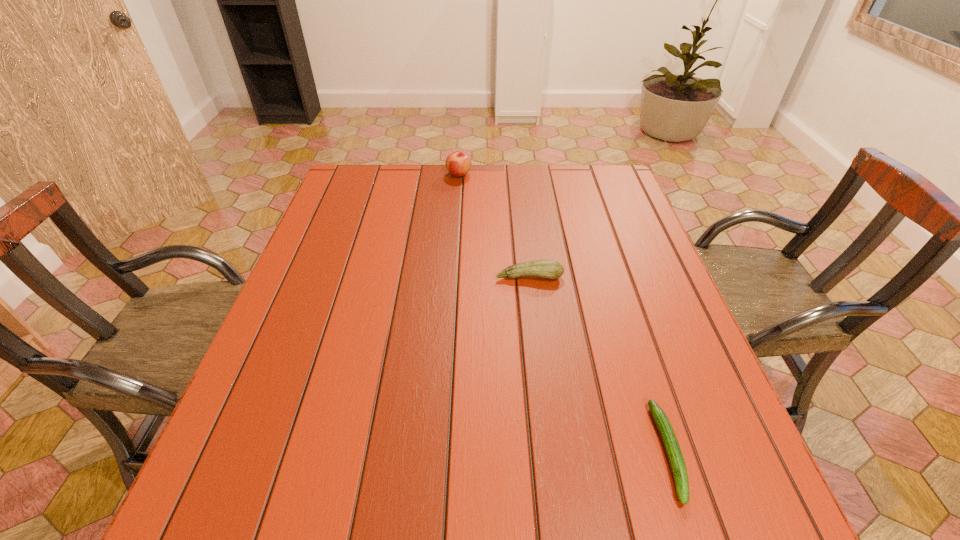
Locate an element on the screen. The height and width of the screenshot is (540, 960). the leftmost object is located at coordinates (458, 163).

This screenshot has width=960, height=540. Find the location of `apple`. apple is located at coordinates (458, 163).

The width and height of the screenshot is (960, 540). Find the location of `the second object from right to left`. the second object from right to left is located at coordinates (550, 269).

I want to click on the second shortest object, so click(x=550, y=269).

Identify the location of the right zucchini. (674, 454).

Identify the location of the shortest object. This screenshot has height=540, width=960. (674, 454).

I want to click on free space located on the right of the apple, so click(487, 174).

Image resolution: width=960 pixels, height=540 pixels. I want to click on blank area located at the stem end of the second tallest object, so 534,316.

At what (x,y) coordinates should I click in order to perform the action: click on object that is at the far edge. Please return your answer as a coordinate pair (x, y). This screenshot has height=540, width=960. Looking at the image, I should click on (458, 163).

I want to click on object located at the near edge, so click(674, 454).